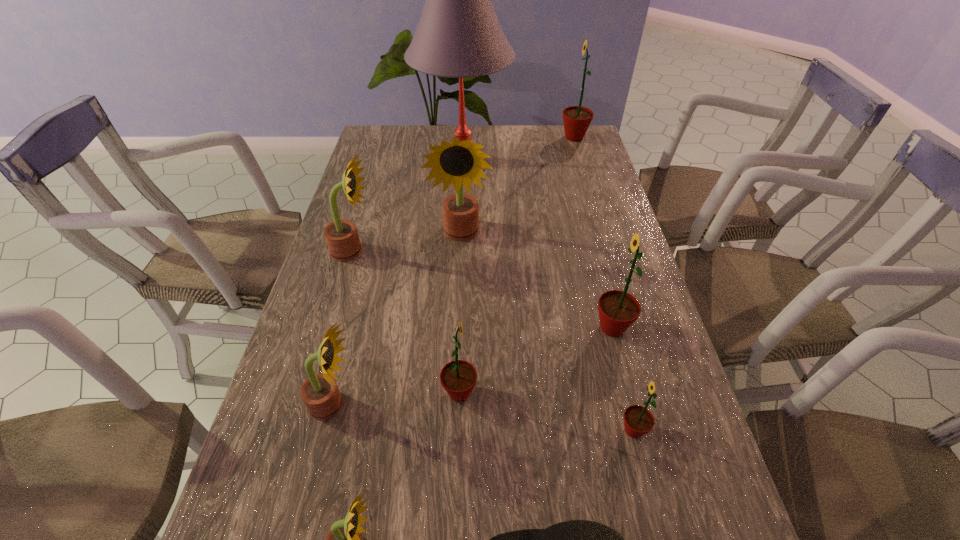
Where is `vacant space at the left edge of the desktop`? This screenshot has height=540, width=960. vacant space at the left edge of the desktop is located at coordinates (359, 316).

Where is `free point at the right edge`? free point at the right edge is located at coordinates (714, 517).

Find the location of a particular element. vacant space at the far left corner of the desktop is located at coordinates (388, 138).

What are the coordinates of `free space at the far right corner of the desktop` in the screenshot? It's located at (561, 140).

Find the location of `vacant space in between the third biggest green sunflower and the light table lamp`. vacant space in between the third biggest green sunflower and the light table lamp is located at coordinates (462, 277).

Identify the location of free area in between the third smallest yellow sunflower and the light table lamp. (408, 206).

The height and width of the screenshot is (540, 960). In order to click on empty location between the nearest green sunflower and the third farthest green sunflower in this screenshot , I will do `click(546, 411)`.

I want to click on blank region between the table lamp and the second nearest yellow sunflower, so click(x=398, y=283).

Identify the location of free space between the second smallest yellow sunflower and the farthest green sunflower. (454, 271).

This screenshot has width=960, height=540. Find the location of `empty location between the third biggest yellow sunflower and the tallest object`. empty location between the third biggest yellow sunflower and the tallest object is located at coordinates (398, 283).